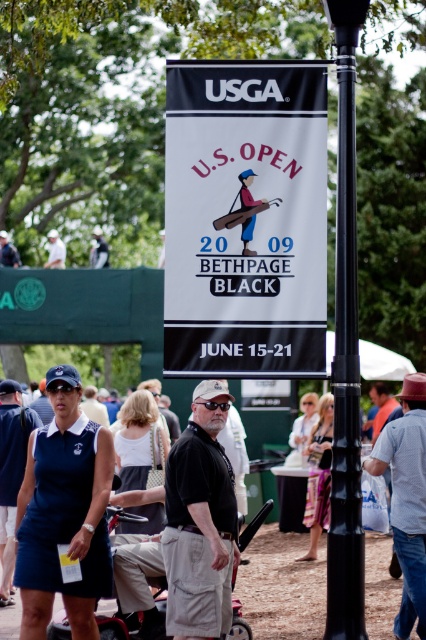
Consider the image. In the image of the 2009 U.S. Open at Bethpage Black, there is a navy blue uniform at lower left and a red plastic baby carriage at lower center. From the perspective of someone standing in front of the banner, which object is positioned to the left?

The red plastic baby carriage at lower center is to the left of the navy blue uniform at lower left.

You are a photographer at the U.S. Open golf event. You want to take a photo of the navy blue uniform at lower left and the red plastic baby carriage at lower center together in the same frame. The camera you are using has a maximum focus range of 5 meters. Will you be able to capture both objects in the same photo?

The navy blue uniform at lower left and the red plastic baby carriage at lower center are 5.52 meters apart from each other. Since the camera can only focus up to 5 meters, the distance between them exceeds the maximum focus range. Therefore, you cannot capture both objects in the same photo.